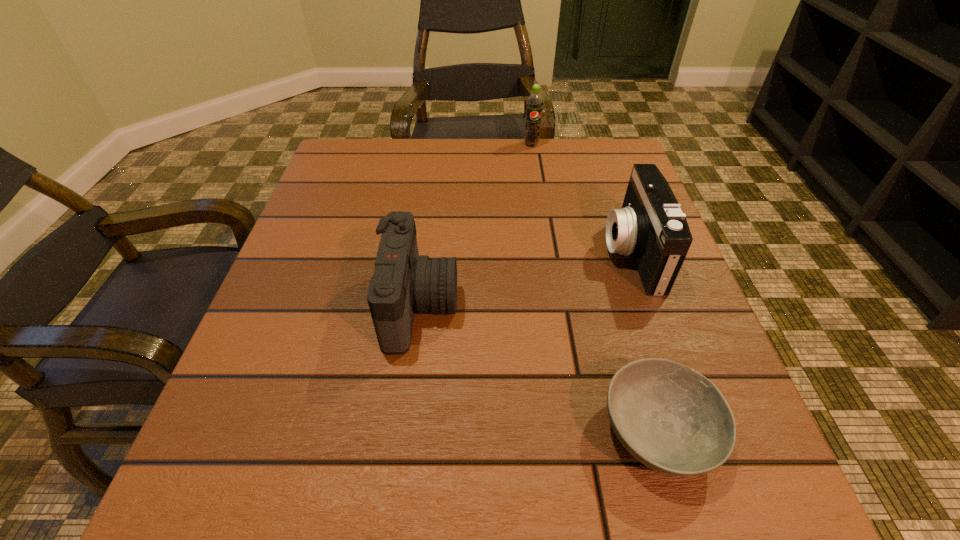
The height and width of the screenshot is (540, 960). What are the coordinates of `unoccupied position between the camcorder and the third object from right to left` in the screenshot? It's located at (582, 199).

Identify the location of vacant region between the camera and the third object from right to left. (476, 225).

The image size is (960, 540). In order to click on free spot between the leftmost object and the shortest object in this screenshot , I will do `click(539, 369)`.

Select which object appears as the closest to the camcorder. Please provide its 2D coordinates. Your answer should be formatted as a tuple, i.e. [(x, y)], where the tuple contains the x and y coordinates of a point satisfying the conditions above.

[(672, 419)]

Select which object appears as the closest to the soda. Please provide its 2D coordinates. Your answer should be formatted as a tuple, i.e. [(x, y)], where the tuple contains the x and y coordinates of a point satisfying the conditions above.

[(650, 226)]

This screenshot has height=540, width=960. I want to click on free location that satisfies the following two spatial constraints: 1. at the lens of the leftmost object; 2. on the back side of the bowl, so click(405, 431).

Where is `free location that satisfies the following two spatial constraints: 1. on the front label of the nearest object; 2. on the right side of the soda`? The width and height of the screenshot is (960, 540). free location that satisfies the following two spatial constraints: 1. on the front label of the nearest object; 2. on the right side of the soda is located at coordinates (577, 431).

Find the location of a particular element. The image size is (960, 540). free space that satisfies the following two spatial constraints: 1. on the front label of the bowl; 2. on the left side of the second object from left to right is located at coordinates (577, 431).

This screenshot has height=540, width=960. Identify the location of free location that satisfies the following two spatial constraints: 1. at the lens of the nearest object; 2. on the right side of the leftmost object. (405, 431).

The image size is (960, 540). Identify the location of free region that satisfies the following two spatial constraints: 1. at the lens of the leftmost object; 2. on the back side of the shortest object. (405, 431).